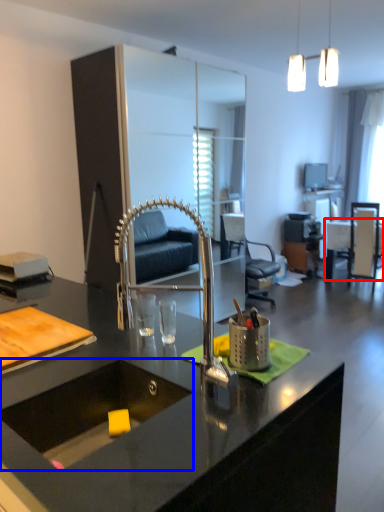
Question: Which object appears closest to the camera in this image, table (highlighted by a red box) or sink (highlighted by a blue box)?

Choices:
 (A) table
 (B) sink

Answer: (B)